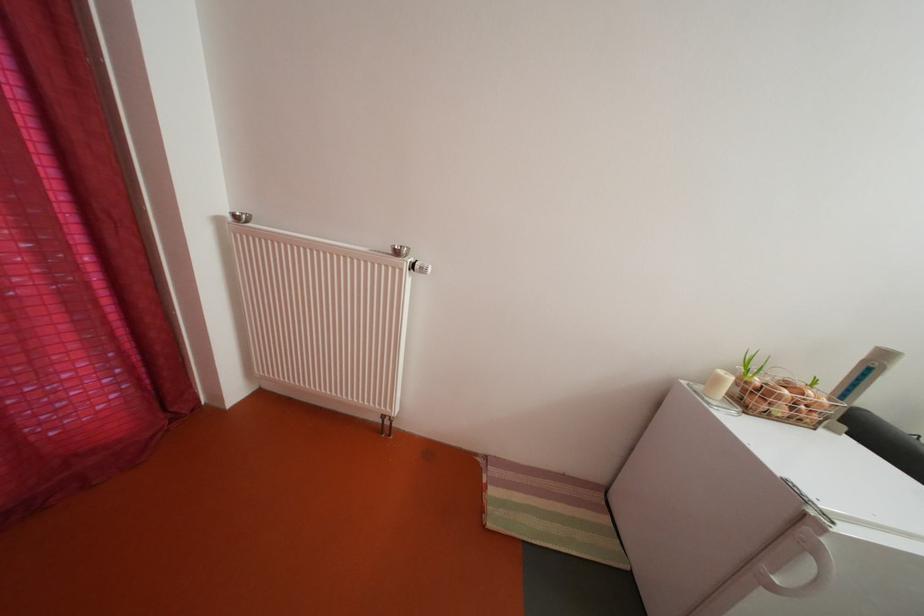
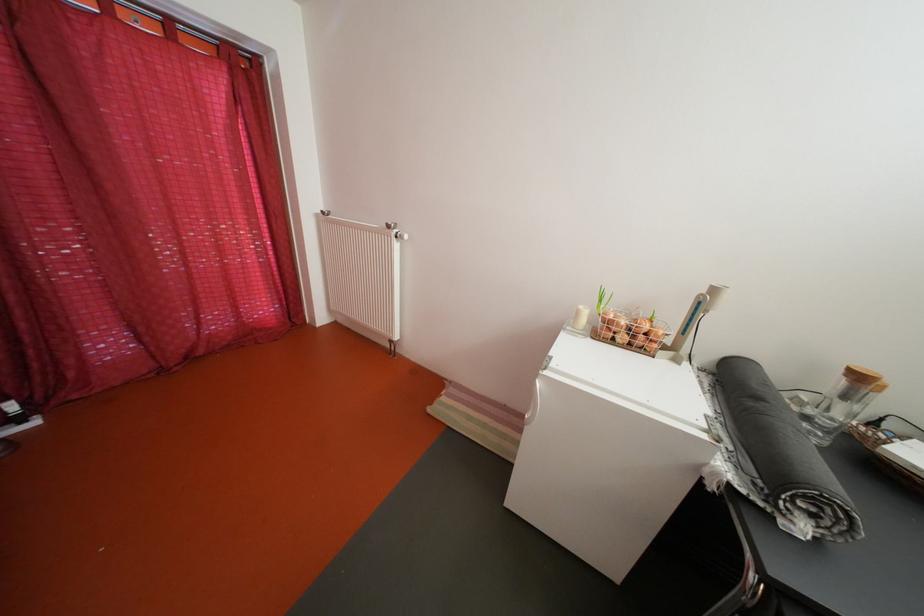
Question: How did the camera likely rotate?

Choices:
 (A) Left
 (B) Right
 (C) Up
 (D) Down

Answer: (A)